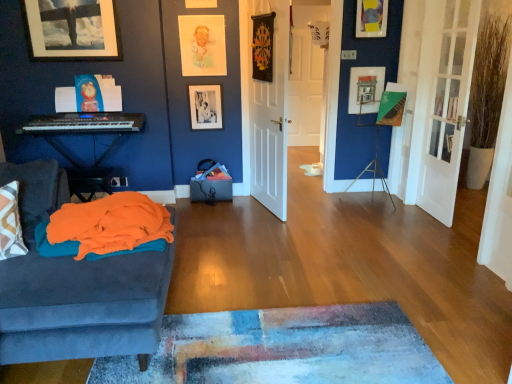
You are a GUI agent. You are given a task and a screenshot of the screen. Output one action in this format:
    pyautogui.click(x=<x>, y=<y>)
    Task: Click on the vacant area located to the right-hand side of white matte door at center, which ranks as the first door in left-to-right order
    
    Given the screenshot: What is the action you would take?
    pyautogui.click(x=312, y=209)